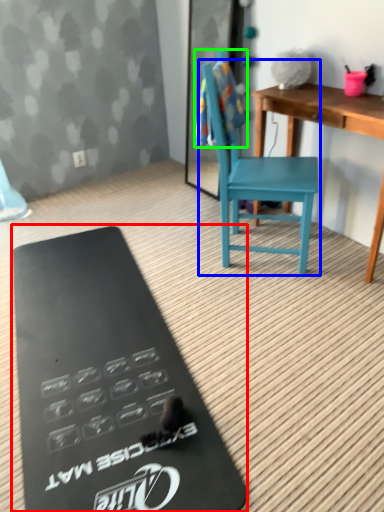
Question: Estimate the real-world distances between objects in this image. Which object is closer to clipboard (highlighted by a red box), armchair (highlighted by a blue box) or towel/napkin (highlighted by a green box)?

Choices:
 (A) armchair
 (B) towel/napkin

Answer: (A)